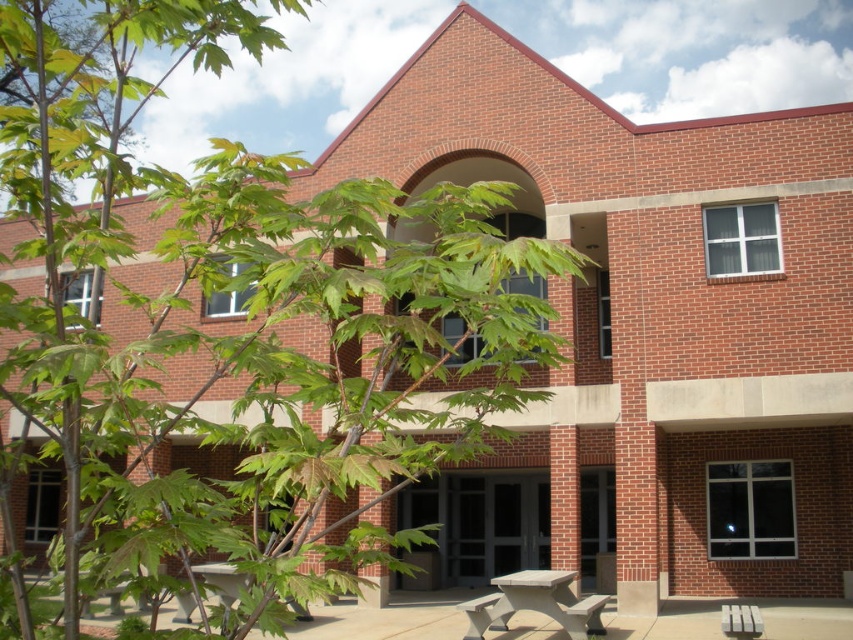
In the scene shown: You are a person who is 1.8 meters tall. You want to sit on either the white plastic park bench at lower right or the smooth gray bench at lower center. Which bench will allow you to sit without bending down?

The smooth gray bench at lower center is taller than the white plastic park bench at lower right, so sitting on the smooth gray bench at lower center would allow you to sit without bending down.

In the scene shown: You are planning to sit on one of the benches in the scene. The white plastic park bench at lower right and the smooth gray bench at lower center are both available. If you want to choose the wider bench, which one should you pick?

→ The white plastic park bench at lower right is wider than the smooth gray bench at lower center, so you should pick the white plastic park bench at lower right.